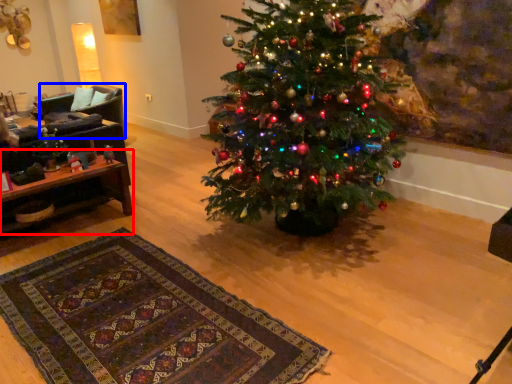
Question: Which point is further to the camera, table (highlighted by a red box) or armchair (highlighted by a blue box)?

Choices:
 (A) table
 (B) armchair

Answer: (B)